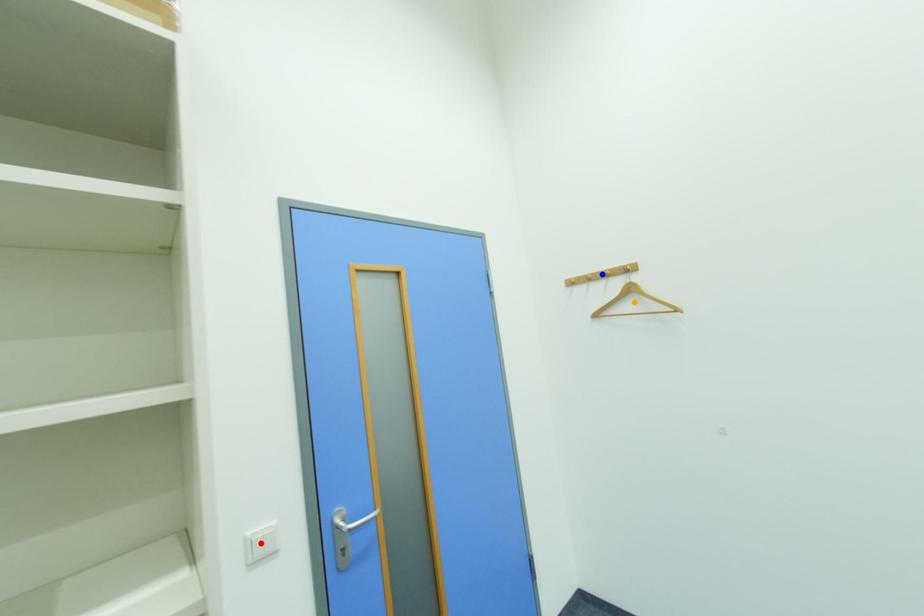
Order these from nearest to farthest:
- blue point
- orange point
- red point

1. red point
2. orange point
3. blue point